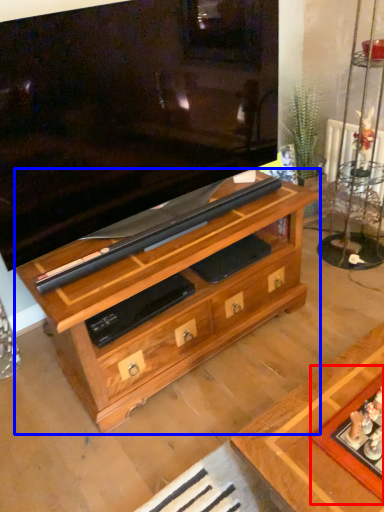
Question: Which of the following is the farthest to the observer, board game (highlighted by a red box) or chest of drawers (highlighted by a blue box)?

Choices:
 (A) board game
 (B) chest of drawers

Answer: (B)